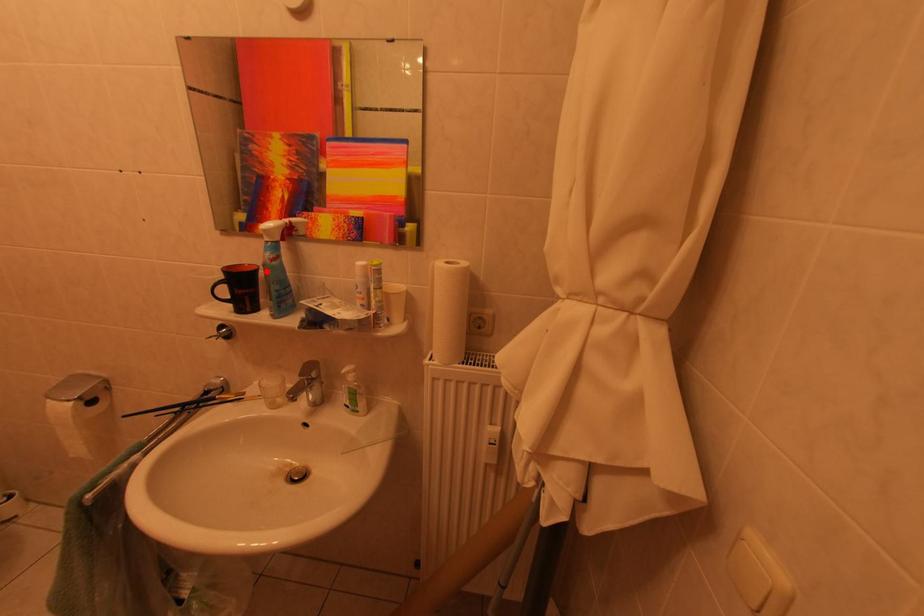
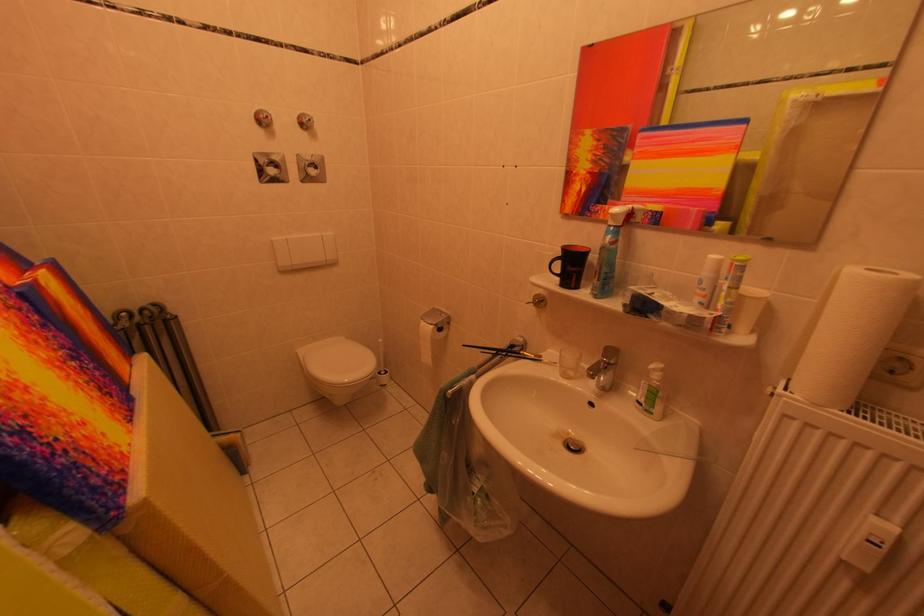
Question: I am providing you with two images of the same scene from different viewpoints. A red point is marked on the first image. At the location where the point appears in image 1, is it still visible in image 2?

Choices:
 (A) Yes
 (B) No

Answer: (A)